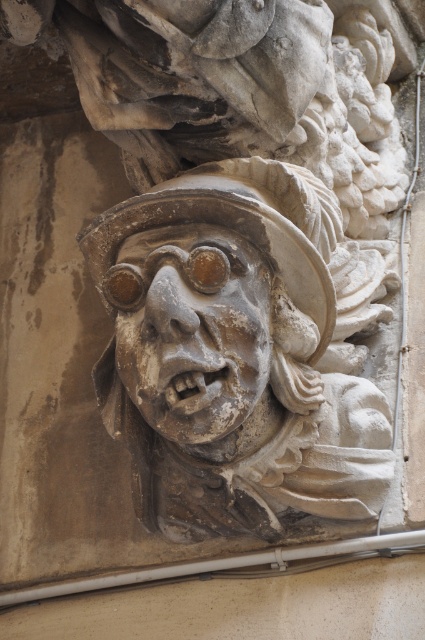
The height and width of the screenshot is (640, 425). What do you see at coordinates (232, 355) in the screenshot? I see `stone carved face at center` at bounding box center [232, 355].

I want to click on stone carved face at center, so click(x=232, y=355).

Locate an element on the screen. This screenshot has width=425, height=640. stone carved face at center is located at coordinates (232, 355).